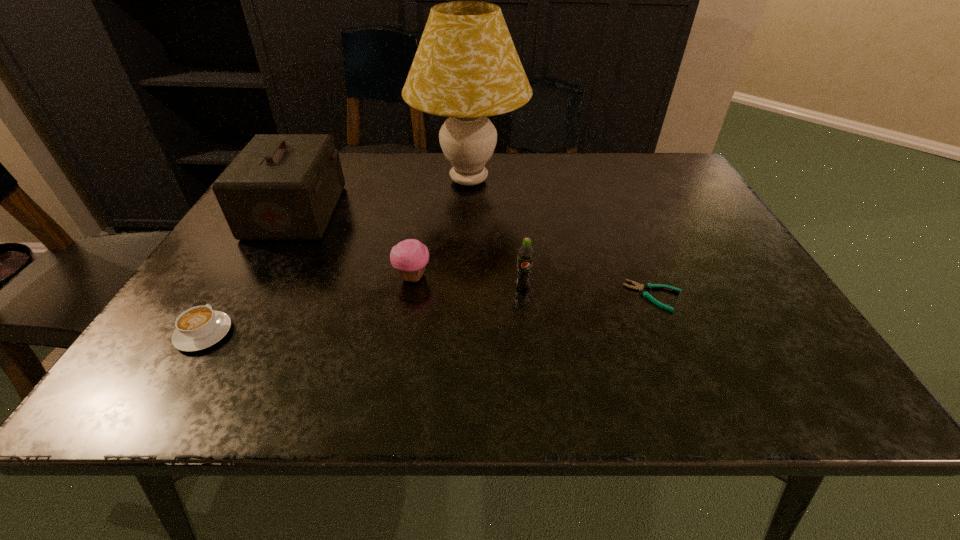
At what (x,y) coordinates should I click in order to perform the action: click on vacant area between the shortest object and the cupcake. Please return your answer as a coordinate pair (x, y). This screenshot has height=540, width=960. Looking at the image, I should click on (534, 287).

Where is `blank region between the cappuccino and the cupcake`? This screenshot has width=960, height=540. blank region between the cappuccino and the cupcake is located at coordinates (308, 306).

At what (x,y) coordinates should I click in order to perform the action: click on free space between the fourth tallest object and the cappuccino. Please return your answer as a coordinate pair (x, y). This screenshot has height=540, width=960. Looking at the image, I should click on (308, 306).

I want to click on unoccupied area between the second shortest object and the fourth shortest object, so click(x=364, y=310).

Where is `vacant point located between the cappuccino and the tallest object`? This screenshot has height=540, width=960. vacant point located between the cappuccino and the tallest object is located at coordinates [336, 257].

Locate an element on the screen. The image size is (960, 540). empty space between the third shortest object and the first-aid kit is located at coordinates (354, 245).

You are a GUI agent. You are given a task and a screenshot of the screen. Output one action in this format:
    pyautogui.click(x=<x>, y=<y>)
    Task: Click on the object that is the closest to the cupcake
    The height and width of the screenshot is (540, 960).
    Given the screenshot: What is the action you would take?
    pyautogui.click(x=525, y=253)

Select which object appears as the closest to the fifth shortest object. Please provide its 2D coordinates. Your answer should be formatted as a tuple, i.e. [(x, y)], where the tuple contains the x and y coordinates of a point satisfying the conditions above.

[(466, 67)]

I want to click on free region that satisfies the following two spatial constraints: 1. on the side of the nearest object with the handle; 2. on the left side of the pliers, so click(x=227, y=296).

Where is `free spot that satisfies the following two spatial constraints: 1. on the side of the shortest object with the handle; 2. on the right side of the cappuccino`? The height and width of the screenshot is (540, 960). free spot that satisfies the following two spatial constraints: 1. on the side of the shortest object with the handle; 2. on the right side of the cappuccino is located at coordinates (227, 296).